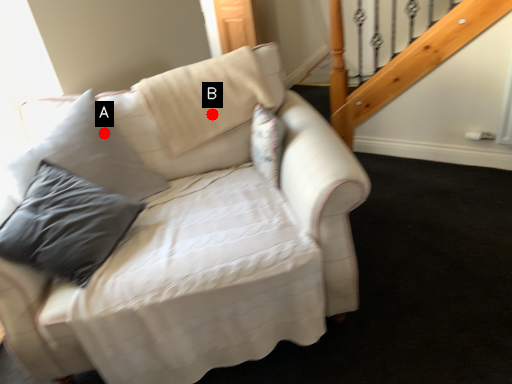
Question: Two points are circled on the image, labeled by A and B beside each circle. Which of the following is the farthest from the observer?

Choices:
 (A) A is further
 (B) B is further

Answer: (B)